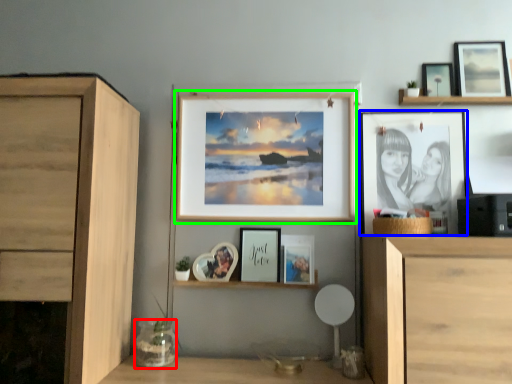
Question: Considering the real-world distances, which object is closest to glass vase (highlighted by a red box)? picture frame (highlighted by a blue box) or picture frame (highlighted by a green box).

Choices:
 (A) picture frame
 (B) picture frame

Answer: (B)